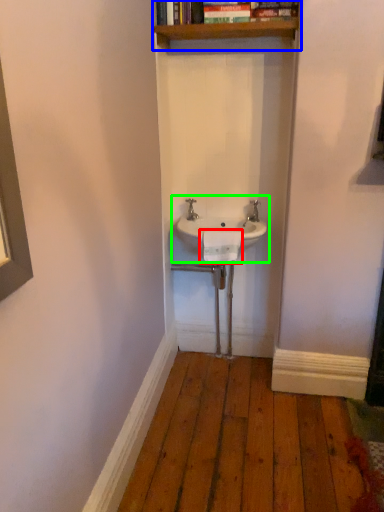
Question: Estimate the real-world distances between objects in this image. Which object is closer to towel bar (highlighted by a red box), shelf (highlighted by a blue box) or sink (highlighted by a green box)?

Choices:
 (A) shelf
 (B) sink

Answer: (B)